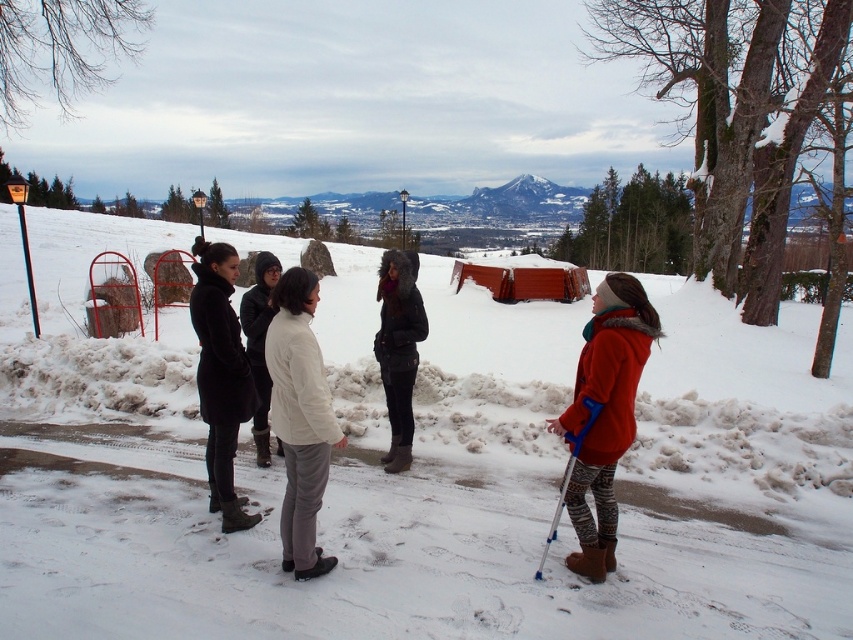
Can you confirm if matte red coat at center is positioned below white woolen coat at center?

Yes.

Can you confirm if matte red coat at center is bigger than white woolen coat at center?

Yes.

Who is more forward, (659, 332) or (267, 276)?

Positioned in front is point (659, 332).

The height and width of the screenshot is (640, 853). In order to click on matte red coat at center in this screenshot , I will do `click(604, 413)`.

Who is shorter, white snow ski slope at center or black wool coat at center?

With less height is black wool coat at center.

Does white snow ski slope at center have a lesser height compared to black wool coat at center?

No, white snow ski slope at center is not shorter than black wool coat at center.

Find the location of `white snow ski slope at center`. white snow ski slope at center is located at coordinates (421, 472).

Image resolution: width=853 pixels, height=640 pixels. What are the coordinates of `white snow ski slope at center` in the screenshot? It's located at (421, 472).

What do you see at coordinates (421, 472) in the screenshot? The image size is (853, 640). I see `white snow ski slope at center` at bounding box center [421, 472].

Does white snow ski slope at center have a lesser width compared to blue plastic ski pole at lower right?

No.

You are a GUI agent. You are given a task and a screenshot of the screen. Output one action in this format:
    pyautogui.click(x=<x>, y=<y>)
    Task: Click on the white snow ski slope at center
    
    Given the screenshot: What is the action you would take?
    pyautogui.click(x=421, y=472)

You are a GUI agent. You are given a task and a screenshot of the screen. Output one action in this format:
    pyautogui.click(x=<x>, y=<y>)
    Task: Click on the white snow ski slope at center
    The width and height of the screenshot is (853, 640).
    Given the screenshot: What is the action you would take?
    pyautogui.click(x=421, y=472)